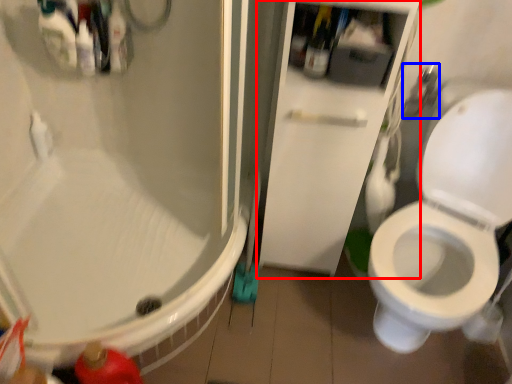
Question: Which object appears closest to the camera in this image, screen door (highlighted by a red box) or shower (highlighted by a blue box)?

Choices:
 (A) screen door
 (B) shower

Answer: (A)